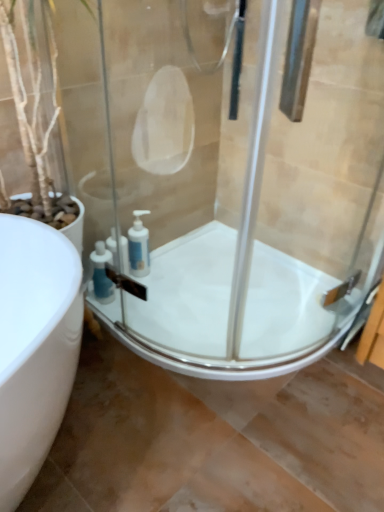
Question: Can you confirm if transparent glass shower door at center is taller than white glossy bath at center?

Choices:
 (A) yes
 (B) no

Answer: (A)

Question: Does transparent glass shower door at center appear on the left side of white glossy bath at center?

Choices:
 (A) no
 (B) yes

Answer: (B)

Question: Does transparent glass shower door at center have a lesser height compared to white glossy bath at center?

Choices:
 (A) yes
 (B) no

Answer: (B)

Question: Does transparent glass shower door at center turn towards white glossy bath at center?

Choices:
 (A) no
 (B) yes

Answer: (A)

Question: Can white glossy bath at center be found inside transparent glass shower door at center?

Choices:
 (A) yes
 (B) no

Answer: (B)

Question: Relative to white glossy bath at center, is white glossy soap dispenser at corner, arranged as the second soap dispenser when viewed from the left, in front or behind?

Choices:
 (A) front
 (B) behind

Answer: (B)

Question: Considering the positions of white glossy soap dispenser at corner, arranged as the second soap dispenser when viewed from the left, and white glossy bath at center in the image, is white glossy soap dispenser at corner, arranged as the second soap dispenser when viewed from the left, taller or shorter than white glossy bath at center?

Choices:
 (A) tall
 (B) short

Answer: (A)

Question: Does point (148, 259) appear closer or farther from the camera than point (319, 286)?

Choices:
 (A) farther
 (B) closer

Answer: (A)

Question: Considering the relative positions of white glossy soap dispenser at corner, which is counted as the first soap dispenser, starting from the right, and white glossy bath at center in the image provided, is white glossy soap dispenser at corner, which is counted as the first soap dispenser, starting from the right, to the left or to the right of white glossy bath at center?

Choices:
 (A) left
 (B) right

Answer: (A)

Question: Is blue plastic soap dispenser at lower center, the 1th soap dispenser in the left-to-right sequence, inside or outside of transparent glass shower door at center?

Choices:
 (A) outside
 (B) inside

Answer: (B)

Question: From the image's perspective, relative to transparent glass shower door at center, is blue plastic soap dispenser at lower center, the 1th soap dispenser in the left-to-right sequence, above or below?

Choices:
 (A) above
 (B) below

Answer: (B)

Question: From a real-world perspective, is blue plastic soap dispenser at lower center, the 1th soap dispenser in the left-to-right sequence, above or below transparent glass shower door at center?

Choices:
 (A) below
 (B) above

Answer: (A)

Question: From their relative heights in the image, would you say blue plastic soap dispenser at lower center, the 1th soap dispenser in the left-to-right sequence, is taller or shorter than transparent glass shower door at center?

Choices:
 (A) tall
 (B) short

Answer: (B)

Question: Considering the positions of white glossy bath at center and transparent glass shower door at center in the image, is white glossy bath at center taller or shorter than transparent glass shower door at center?

Choices:
 (A) short
 (B) tall

Answer: (A)

Question: From the image's perspective, is white glossy bath at center positioned above or below transparent glass shower door at center?

Choices:
 (A) below
 (B) above

Answer: (A)